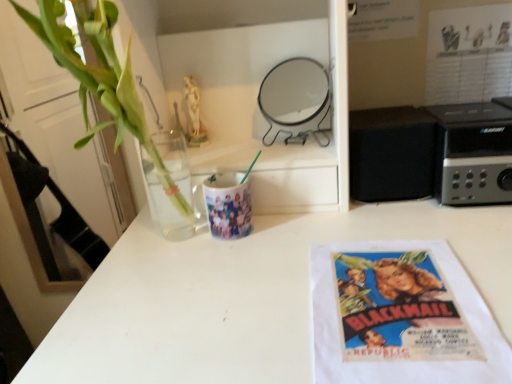
Question: From the image's perspective, would you say white paper towel at lower right is positioned over green leafy plant at left?

Choices:
 (A) no
 (B) yes

Answer: (A)

Question: Can you confirm if white paper towel at lower right is wider than green leafy plant at left?

Choices:
 (A) yes
 (B) no

Answer: (A)

Question: Would you say green leafy plant at left is part of white paper towel at lower right's contents?

Choices:
 (A) yes
 (B) no

Answer: (B)

Question: Are white paper towel at lower right and green leafy plant at left beside each other?

Choices:
 (A) no
 (B) yes

Answer: (A)

Question: From a real-world perspective, is white paper towel at lower right physically above green leafy plant at left?

Choices:
 (A) yes
 (B) no

Answer: (B)

Question: Is white paper towel at lower right positioned in front of green leafy plant at left?

Choices:
 (A) yes
 (B) no

Answer: (A)

Question: From a real-world perspective, is black matte speaker at right, which ranks as the 2th appliance in left-to-right order, below green leafy plant at left?

Choices:
 (A) yes
 (B) no

Answer: (A)

Question: From a real-world perspective, is black matte speaker at right, which ranks as the 2th appliance in left-to-right order, on top of green leafy plant at left?

Choices:
 (A) no
 (B) yes

Answer: (A)

Question: Would you say black matte speaker at right, which ranks as the 2th appliance in left-to-right order, is outside green leafy plant at left?

Choices:
 (A) no
 (B) yes

Answer: (B)

Question: From the image's perspective, is black matte speaker at right, which ranks as the 2th appliance in left-to-right order, over green leafy plant at left?

Choices:
 (A) yes
 (B) no

Answer: (B)

Question: Considering the relative sizes of black matte speaker at right, which ranks as the 2th appliance in left-to-right order, and green leafy plant at left in the image provided, is black matte speaker at right, which ranks as the 2th appliance in left-to-right order, thinner than green leafy plant at left?

Choices:
 (A) yes
 (B) no

Answer: (B)

Question: Is black matte speaker at right, which ranks as the 2th appliance in left-to-right order, turned away from green leafy plant at left?

Choices:
 (A) yes
 (B) no

Answer: (B)

Question: Can you confirm if black plastic stereo at right, the first appliance when ordered from right to left, is smaller than metallic round mirror at upper center, which is counted as the 1th appliance, starting from the left?

Choices:
 (A) no
 (B) yes

Answer: (A)